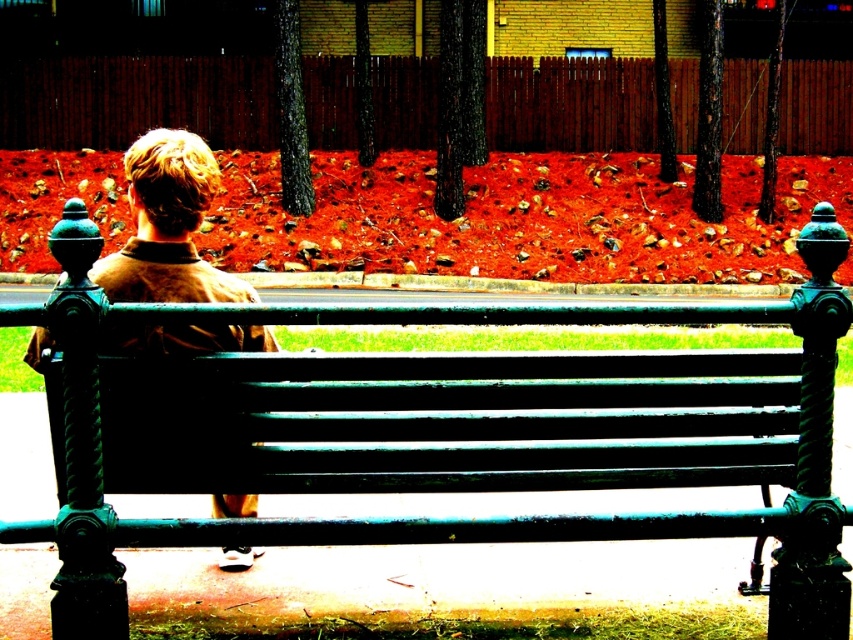
Looking at this image, you are standing at the point marked by coordinates (431, 433) in the image. What object are you standing on?

The point (431, 433) corresponds to the green painted wood bench at center.

You are a person standing behind the brown woolen jacket at center and want to sit on the green painted wood bench at center. Can you reach the bench without moving your jacket?

The green painted wood bench at center is in front of the brown woolen jacket at center, so you can reach the bench without moving your jacket because it is already in front of you.